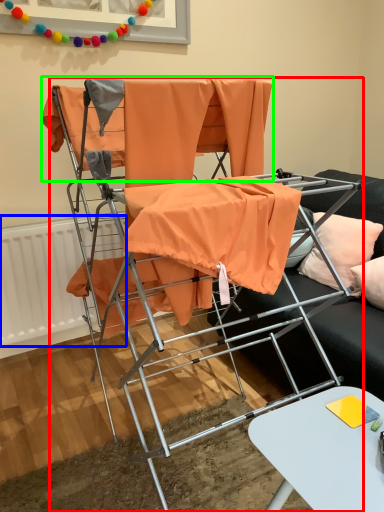
Question: Estimate the real-world distances between objects in this image. Which object is farther from chair (highlighted by a red box), radiator (highlighted by a blue box) or fabric (highlighted by a green box)?

Choices:
 (A) radiator
 (B) fabric

Answer: (A)